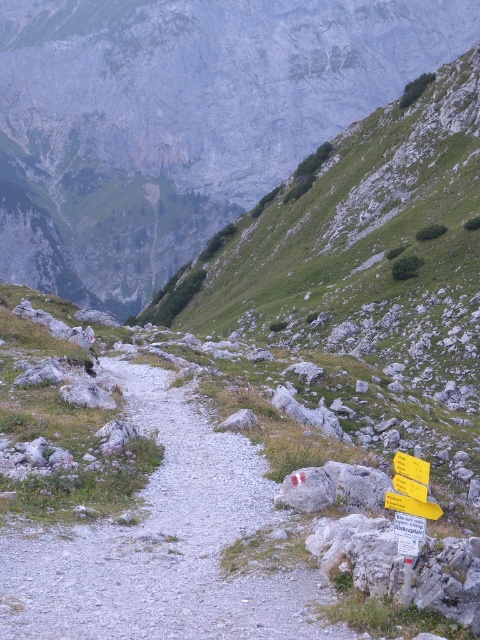
Question: Is green grassy mountain at center bigger than gray gravel path at center?

Choices:
 (A) yes
 (B) no

Answer: (A)

Question: Does gray gravel path at center have a larger size compared to yellow plastic sign at lower right?

Choices:
 (A) yes
 (B) no

Answer: (A)

Question: Which point appears farthest from the camera in this image?

Choices:
 (A) (134, 28)
 (B) (10, 621)
 (C) (407, 502)

Answer: (A)

Question: Which object appears closest to the camera in this image?

Choices:
 (A) yellow plastic sign at lower right
 (B) gray gravel path at center

Answer: (B)

Question: Can you confirm if gray gravel path at center is thinner than yellow plastic sign at lower right?

Choices:
 (A) yes
 (B) no

Answer: (B)

Question: Which point appears closest to the camera in this image?

Choices:
 (A) (389, 493)
 (B) (63, 100)
 (C) (231, 502)

Answer: (A)